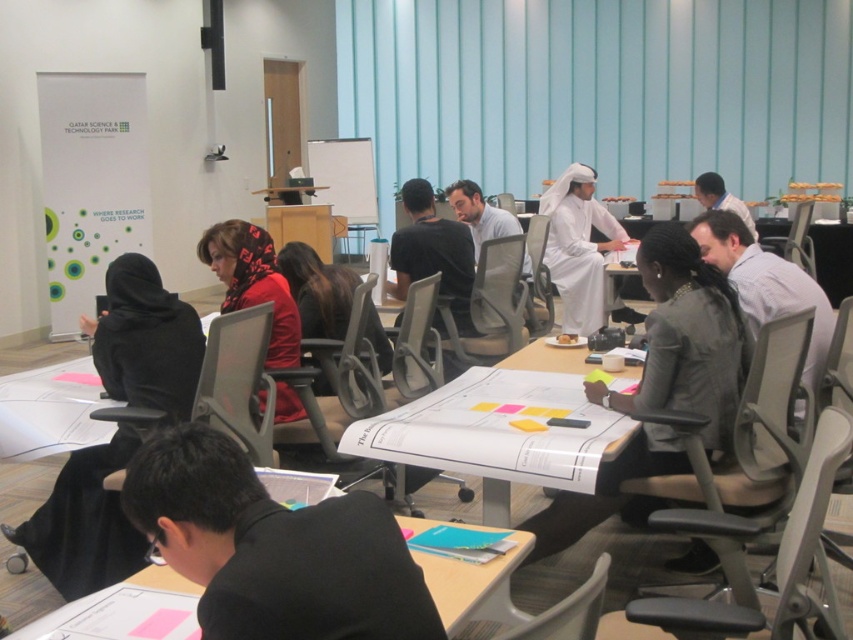
You are attending a meeting and need to pass a document to the person wearing the gray fabric jacket at center. Which direction should you move to reach them from the black matte shirt at lower center?

The black matte shirt at lower center is to the left of the gray fabric jacket at center, so you should move to the right to reach the gray fabric jacket at center from the black matte shirt at lower center.

You are standing in the room and want to move from point (364, 592) to point (709, 288). Which direction should you move to get closer to your destination?

You should move towards the direction away from the viewer because point (709, 288) is further from the viewer compared to point (364, 592).